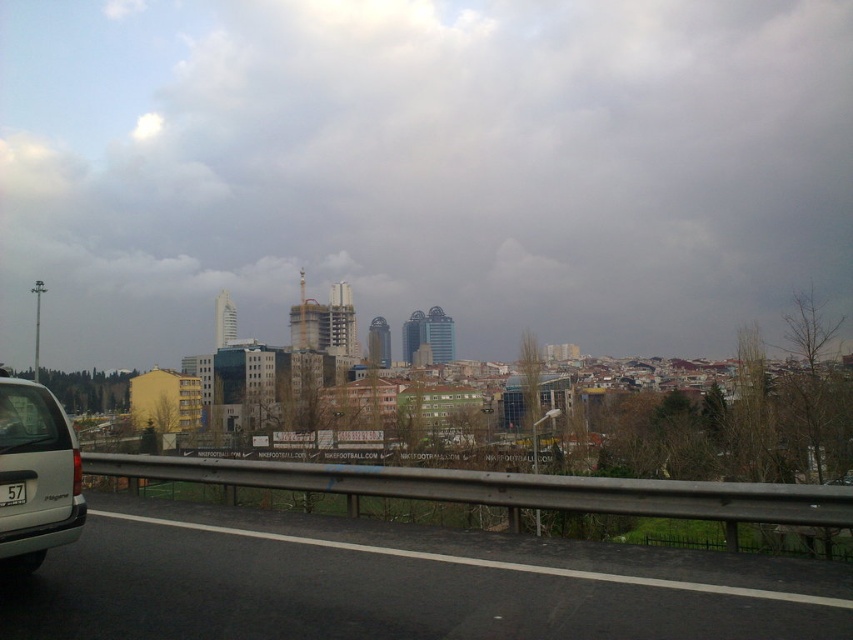
You are a delivery driver who needs to navigate through the area shown in the image. The silver metallic van at lower left is blocking your path. Can you estimate its position relative to the guardrail? Is it closer to the guardrail or farther away from it?

The silver metallic van at lower left is positioned at point (36, 474). Since the coordinates are based on a 2D grid where lower values indicate closer proximity to the guardrail, the van is closer to the guardrail.

You are driving along a road with a guardrail and see two points marked on the road ahead. The first point is at coordinates point [183,621] and the second is at point [0,554]. Which point is closer to your current position?

Point [183,621] is closer to the viewer than point [0,554].

You are driving on a road and want to ensure you can see both the black asphalt highway at lower left and the black plastic license plate at lower left in your rearview mirror. Which object will take up more space in your mirror?

The black asphalt highway at lower left is larger in size than the black plastic license plate at lower left, so it will take up more space in your rearview mirror.